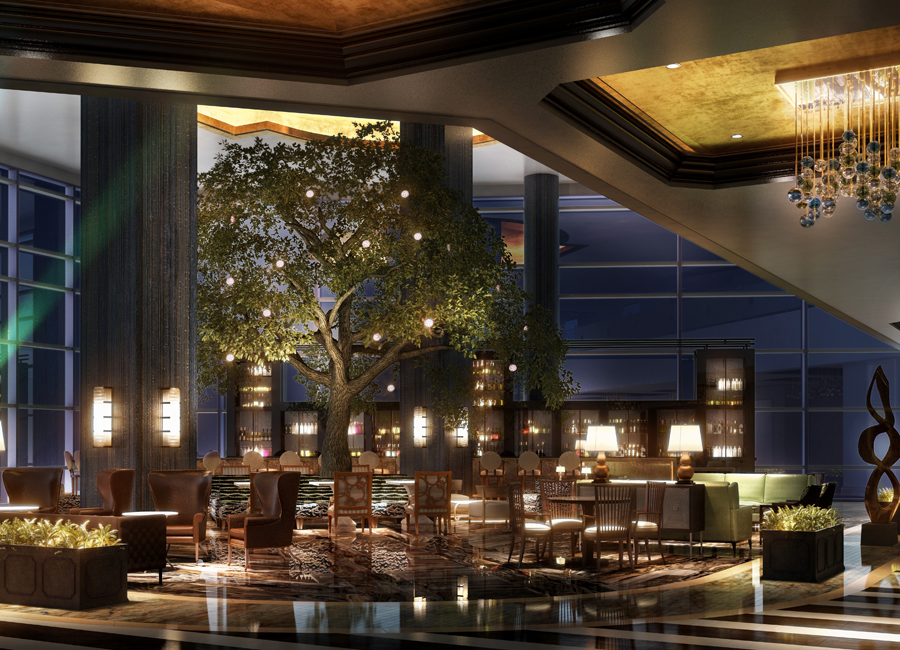
Where is `lamps`? This screenshot has width=900, height=650. lamps is located at coordinates click(688, 465), click(599, 463).